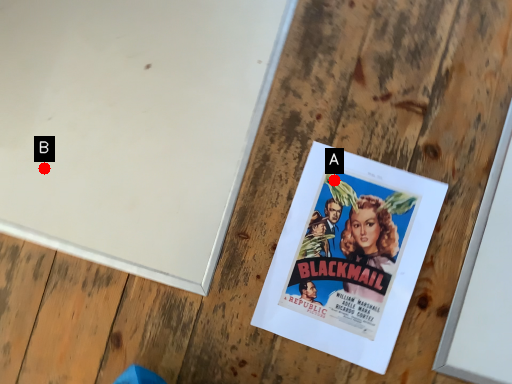
Question: Two points are circled on the image, labeled by A and B beside each circle. Which point is closer to the camera taking this photo?

Choices:
 (A) A is closer
 (B) B is closer

Answer: (A)